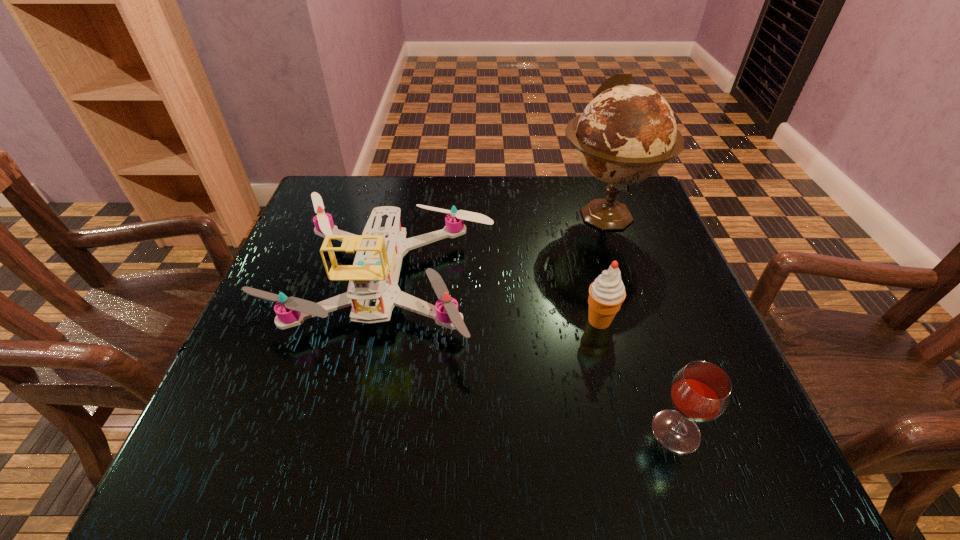
This screenshot has height=540, width=960. I want to click on vacant area that lies between the wineglass and the drone, so click(530, 357).

Where is `free point between the nearest object and the third shortest object`? Image resolution: width=960 pixels, height=540 pixels. free point between the nearest object and the third shortest object is located at coordinates (530, 357).

Where is `free space between the drone and the nearest object`? free space between the drone and the nearest object is located at coordinates (530, 357).

Identify the location of unoccupied area between the icecream and the tallest object. (602, 268).

Locate which object is the third closest to the leftmost object. Please provide its 2D coordinates. Your answer should be formatted as a tuple, i.e. [(x, y)], where the tuple contains the x and y coordinates of a point satisfying the conditions above.

[(700, 392)]

Image resolution: width=960 pixels, height=540 pixels. I want to click on object that can be found as the closest to the icecream, so click(x=700, y=392).

Locate an element on the screen. The image size is (960, 540). vacant point that satisfies the following two spatial constraints: 1. on the front-facing side of the nearest object; 2. on the left side of the third shortest object is located at coordinates (352, 431).

The height and width of the screenshot is (540, 960). I want to click on free space that satisfies the following two spatial constraints: 1. on the front-facing side of the nearest object; 2. on the right side of the second tallest object, so click(x=352, y=431).

Find the location of `vacant space that satisfies the following two spatial constraints: 1. on the front-facing side of the icecream; 2. on the left side of the leftmost object`. vacant space that satisfies the following two spatial constraints: 1. on the front-facing side of the icecream; 2. on the left side of the leftmost object is located at coordinates (376, 321).